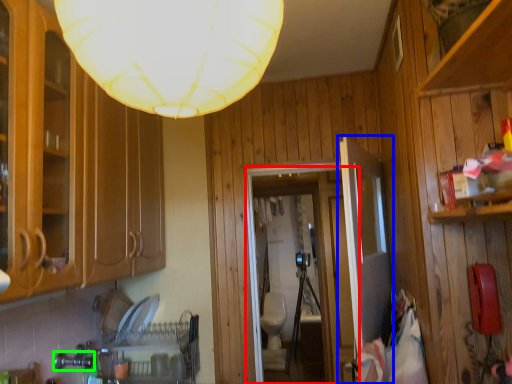
Question: Which object is positioned closest to glass door (highlighted by a red box)? Select from door (highlighted by a blue box) and faucet (highlighted by a green box).

Choices:
 (A) door
 (B) faucet

Answer: (A)